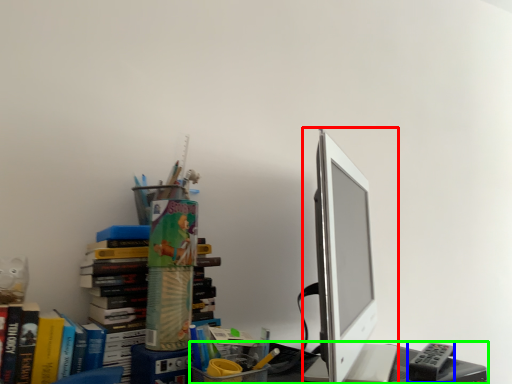
Question: Which object is the farthest from computer monitor (highlighted by a red box)? Choose among these: stationery (highlighted by a blue box) or desk (highlighted by a green box).

Choices:
 (A) stationery
 (B) desk

Answer: (A)